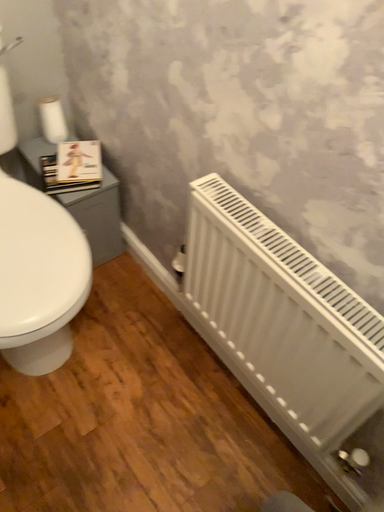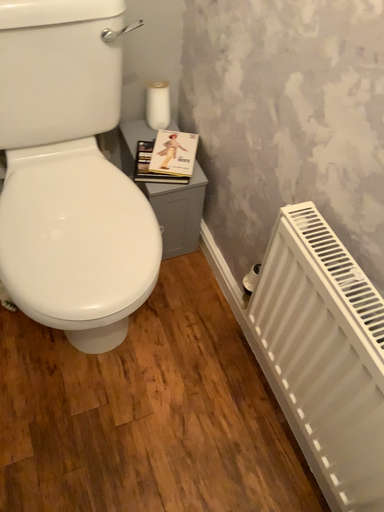
Question: How did the camera likely rotate when shooting the video?

Choices:
 (A) rotated left
 (B) rotated right

Answer: (A)